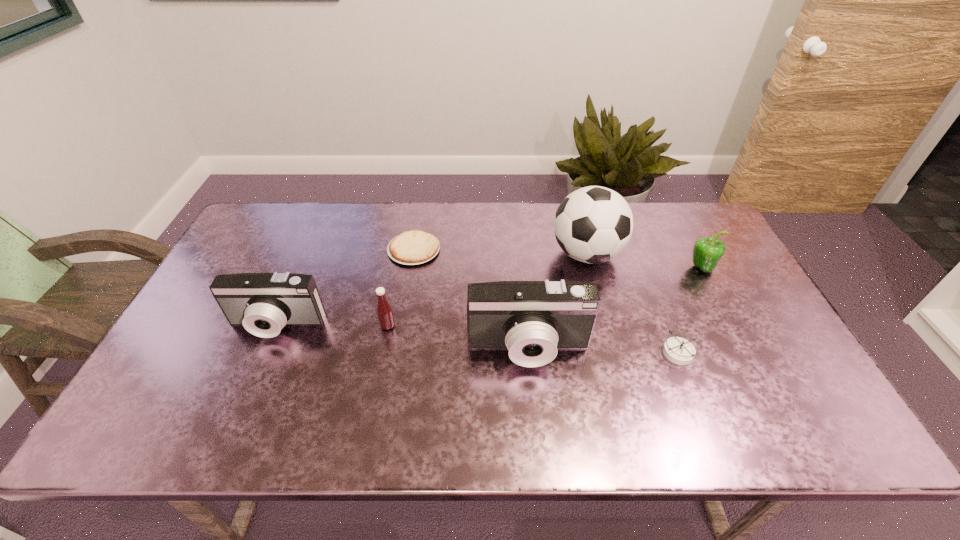
Find the location of a particular element. Image resolution: width=960 pixels, height=540 pixels. vacant position located on the lens of the shorter camcorder is located at coordinates (260, 364).

This screenshot has width=960, height=540. What are the coordinates of `free space located on the right of the shortest object` in the screenshot? It's located at (558, 249).

At what (x,y) coordinates should I click in order to perform the action: click on free location located 0.190m on the left of the soccer ball. Please return your answer as a coordinate pair (x, y). This screenshot has height=540, width=960. Looking at the image, I should click on (491, 254).

The image size is (960, 540). I want to click on vacant space located 0.220m on the back of the compass, so click(x=649, y=280).

The image size is (960, 540). Identify the location of vacant space situated 0.150m on the left of the rightmost object. coord(639,268).

I want to click on vacant space situated 0.380m on the left of the Tabasco sauce, so click(239, 326).

Image resolution: width=960 pixels, height=540 pixels. What are the coordinates of `tortilla that is positioned at the far edge` in the screenshot? It's located at (414, 247).

Where is `soccer ball present at the far edge`? Image resolution: width=960 pixels, height=540 pixels. soccer ball present at the far edge is located at coordinates (594, 224).

You are a GUI agent. You are given a task and a screenshot of the screen. Output one action in this format:
    pyautogui.click(x=<x>, y=<y>)
    Task: Click on the object that is at the near edge
    Image resolution: width=960 pixels, height=540 pixels.
    Given the screenshot: What is the action you would take?
    pyautogui.click(x=532, y=319)

Where is `object present at the left edge`? This screenshot has height=540, width=960. object present at the left edge is located at coordinates (263, 303).